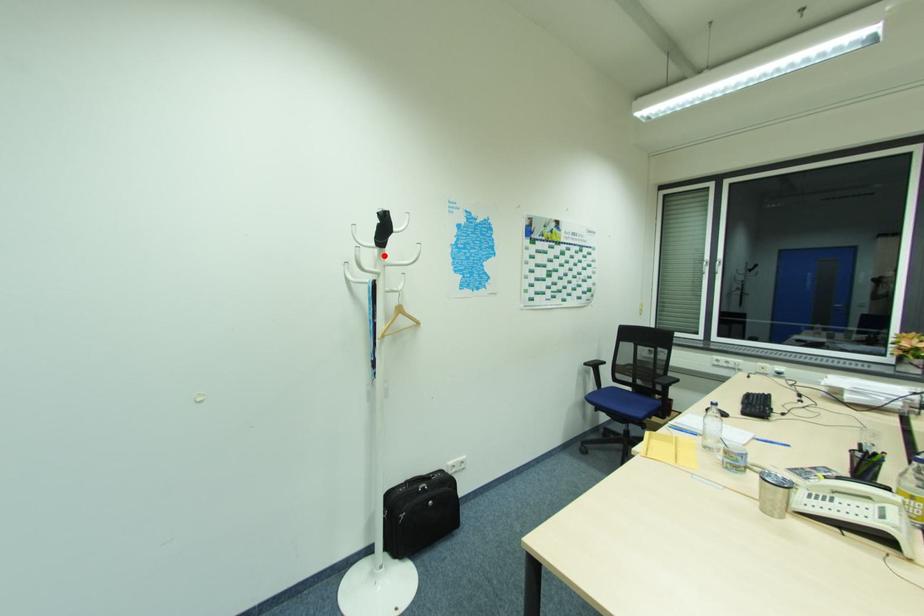
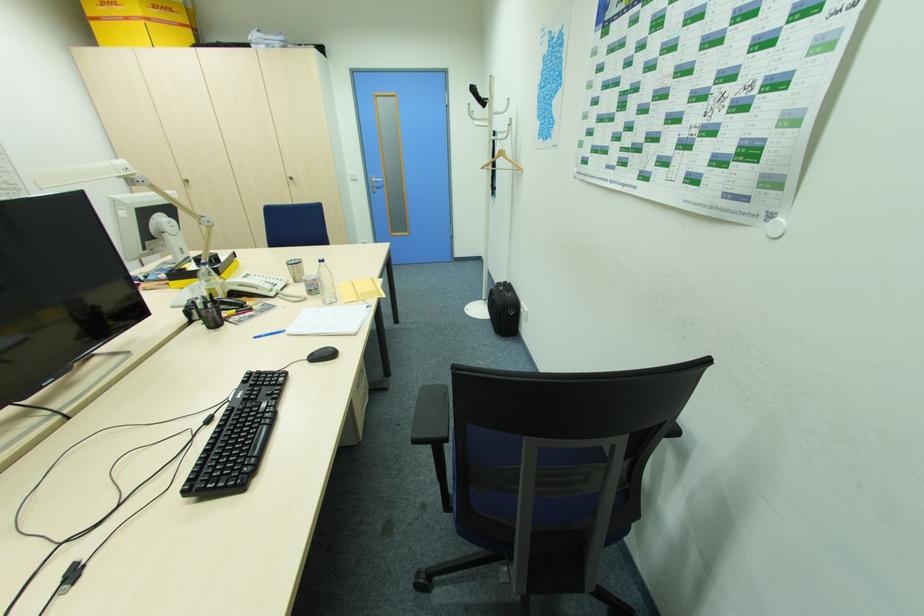
Locate, in the second image, the point that corresponds to the highlighted location in the first image.

(493, 113)